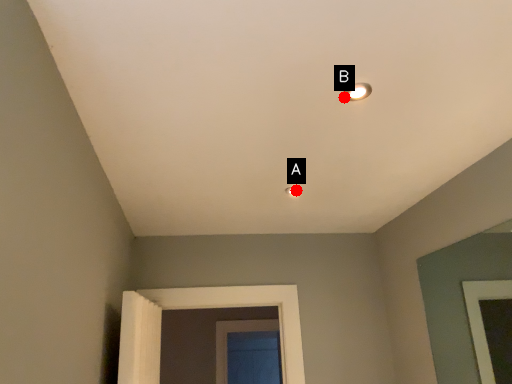
Question: Two points are circled on the image, labeled by A and B beside each circle. Which point is closer to the camera?

Choices:
 (A) A is closer
 (B) B is closer

Answer: (B)